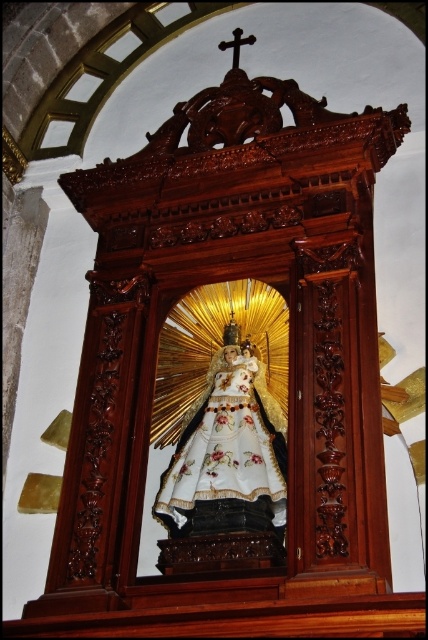
You are an art student analyzing the composition of the altar. Based on the image, which object is positioned higher up on the altar between the white satin robe at center and the polished dark wood cross at upper center?

The polished dark wood cross at upper center is positioned higher up on the altar than the white satin robe at center.

You are standing in front of the shrine and want to take a photo of the point at coordinates point (184, 525). Given that your camera has a maximum focus range of 50 meters, will you be able to capture the point clearly?

The distance of point (184, 525) from the camera is 46.95 meters, which is within the camera maximum focus range of 50 meters. Therefore, the camera can capture the point clearly.

You are standing in front of the altar and notice two points marked on the floor. The first point is at coordinates point (x=244, y=396) and the second is at point (x=240, y=28). Which point is closer to you?

Point (x=244, y=396) is in front of point (x=240, y=28), so it is closer to you.